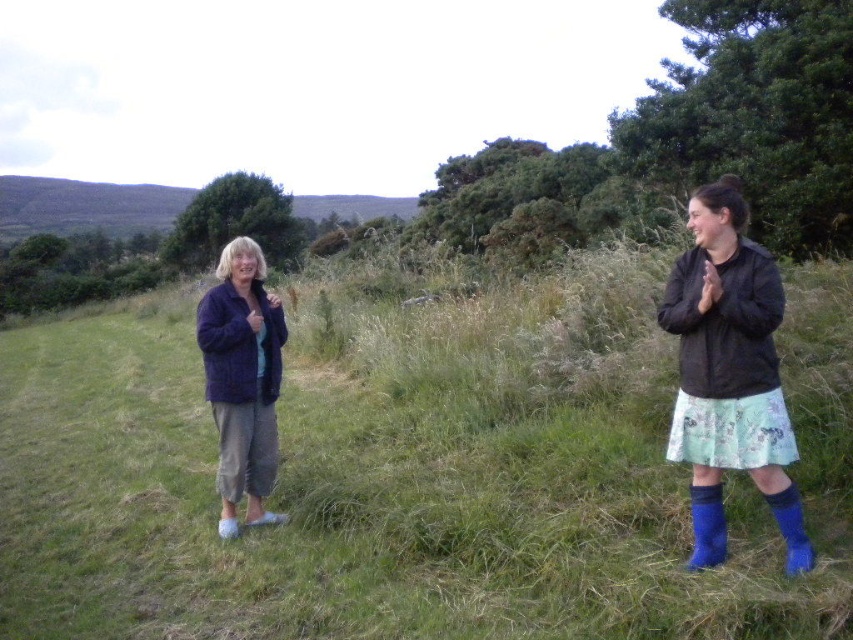
Does green grassy at center appear on the left side of floral skirt at right?

Correct, you'll find green grassy at center to the left of floral skirt at right.

Is green grassy at center shorter than floral skirt at right?

In fact, green grassy at center may be taller than floral skirt at right.

The image size is (853, 640). I want to click on green grassy at center, so click(413, 470).

Identify the location of green grassy at center. This screenshot has width=853, height=640. (413, 470).

This screenshot has height=640, width=853. What do you see at coordinates (413, 470) in the screenshot?
I see `green grassy at center` at bounding box center [413, 470].

Looking at this image, who is taller, green grassy at center or dark blue fleece jacket at left?

green grassy at center

This screenshot has height=640, width=853. Identify the location of green grassy at center. pos(413,470).

Is floral skirt at right bigger than dark blue fleece jacket at left?

Yes, floral skirt at right is bigger than dark blue fleece jacket at left.

Locate an element on the screen. This screenshot has width=853, height=640. floral skirt at right is located at coordinates (729, 372).